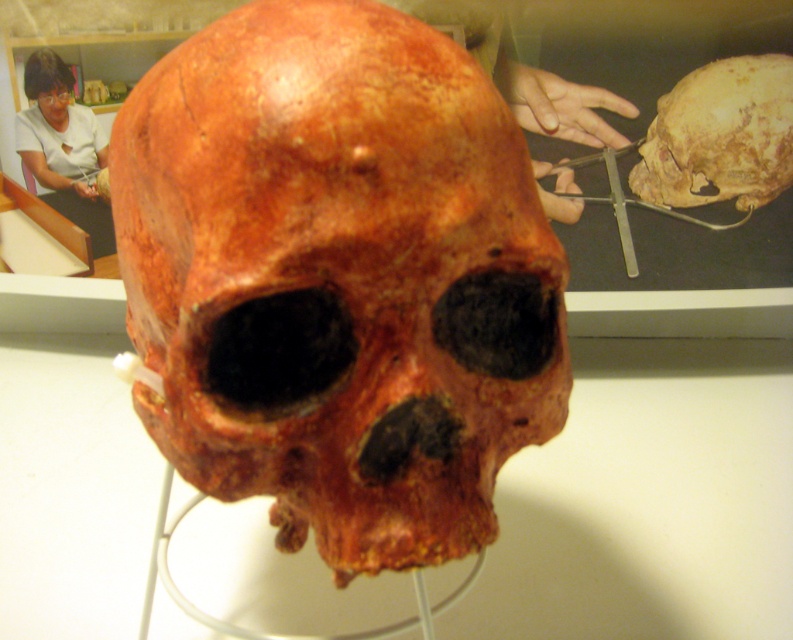
Between point (764, 120) and point (29, 161), which one is positioned in front?

Point (764, 120) is in front.

Does matte brown skull at center come behind matte white shirt at upper left?

That is True.

The height and width of the screenshot is (640, 793). Describe the element at coordinates (719, 134) in the screenshot. I see `matte brown skull at center` at that location.

At what (x,y) coordinates should I click in order to perform the action: click on matte brown skull at center. Please return your answer as a coordinate pair (x, y). The height and width of the screenshot is (640, 793). Looking at the image, I should click on (719, 134).

Is rusty brown skull at center positioned before matte brown skull at center?

Yes, rusty brown skull at center is in front of matte brown skull at center.

Between point (179, 429) and point (788, 120), which one is positioned behind?

Positioned behind is point (788, 120).

Find the location of a particular element. The image size is (793, 640). rusty brown skull at center is located at coordinates (338, 278).

Is rusty brown skull at center to the right of matte white shirt at upper left from the viewer's perspective?

Correct, you'll find rusty brown skull at center to the right of matte white shirt at upper left.

Locate an element on the screen. This screenshot has height=640, width=793. rusty brown skull at center is located at coordinates (338, 278).

Identify the location of rusty brown skull at center. (338, 278).